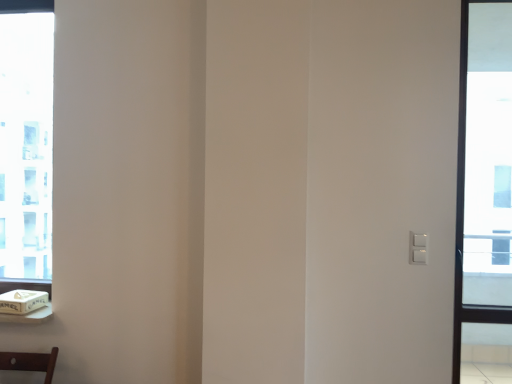
Question: Would you say transparent glass window at right, the 2th window viewed from the left, is inside or outside clear glass window at left, the 2th window in the right-to-left sequence?

Choices:
 (A) inside
 (B) outside

Answer: (B)

Question: From a real-world perspective, is transparent glass window at right, arranged as the 1th window when viewed from the right, positioned above or below clear glass window at left, the 2th window in the right-to-left sequence?

Choices:
 (A) above
 (B) below

Answer: (B)

Question: Considering the real-world distances, which object is closest to the clear glass window at left, arranged as the second window when viewed from the front?

Choices:
 (A) transparent glass window at right, the 2th window viewed from the left
 (B) white cardboard box at lower left

Answer: (B)

Question: Considering the real-world distances, which object is closest to the white cardboard box at lower left?

Choices:
 (A) transparent glass window at right, the 2th window viewed from the left
 (B) clear glass window at left, arranged as the second window when viewed from the front

Answer: (B)